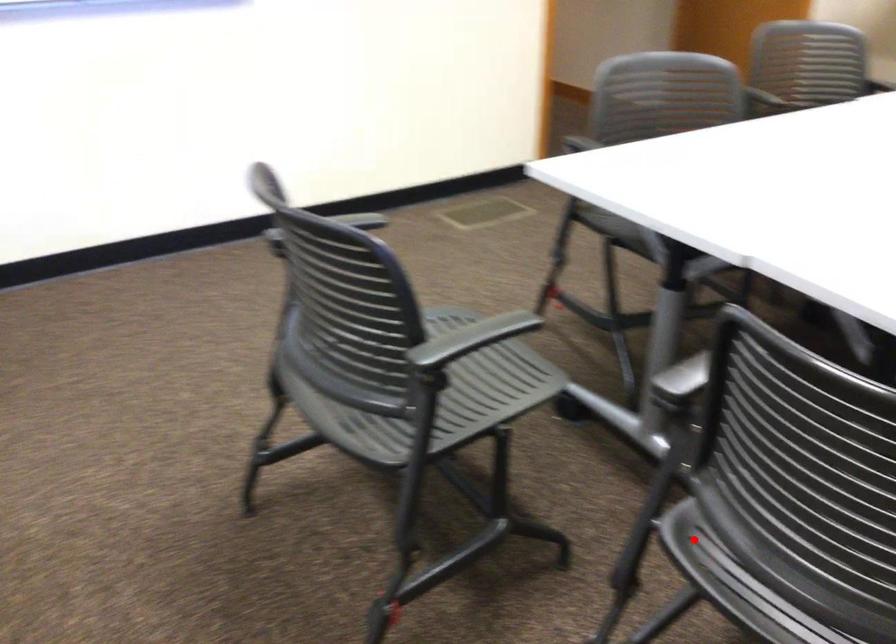
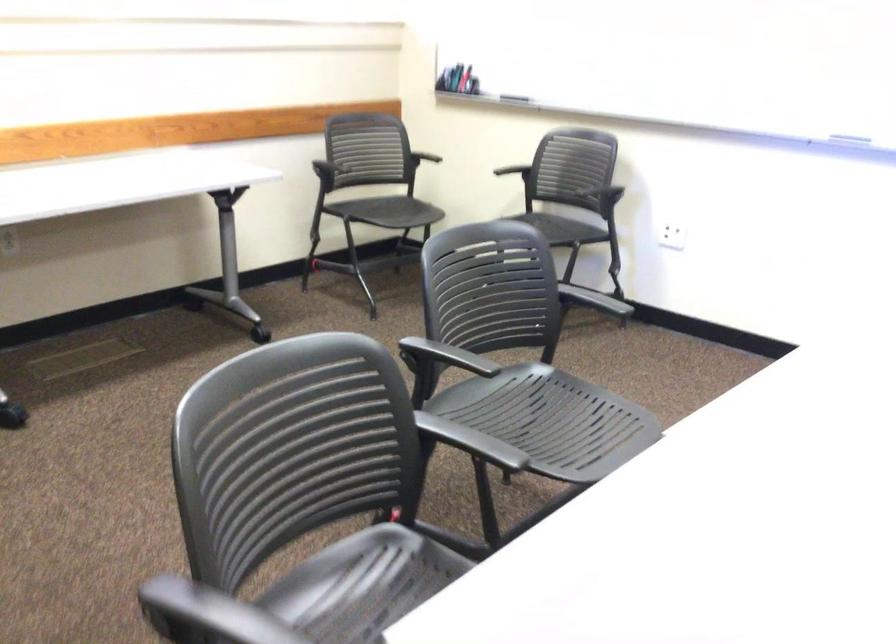
The point at the highlighted location is marked in the first image. Where is the corresponding point in the second image?

(362, 585)